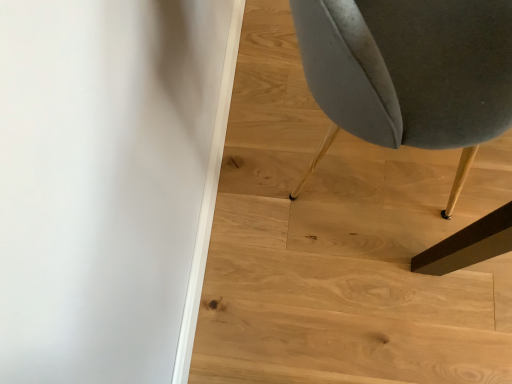
Measure the distance between point (463, 248) and camera.

Point (463, 248) and camera are 3.73 feet apart.

What do you see at coordinates (410, 71) in the screenshot? The height and width of the screenshot is (384, 512). I see `velvet grey chair at right` at bounding box center [410, 71].

What are the coordinates of `velvet grey chair at right` in the screenshot? It's located at (410, 71).

Locate an element on the screen. This screenshot has width=512, height=384. velvet grey chair at right is located at coordinates 410,71.